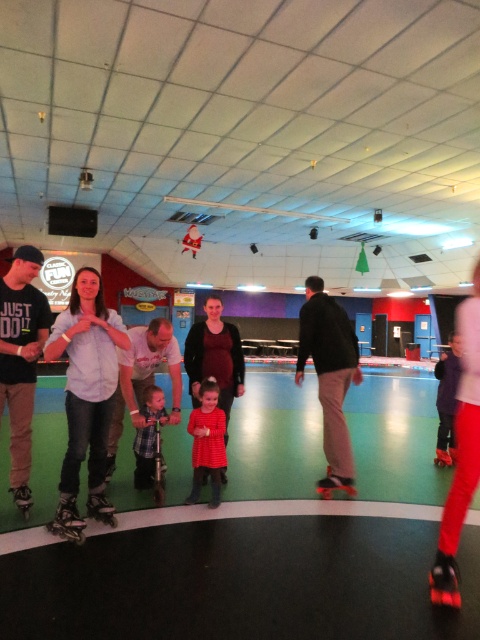
Is black matte jacket at center positioned before plaid shirt at center?

No, it is not.

Does black matte jacket at center appear on the right side of plaid shirt at center?

Indeed, black matte jacket at center is positioned on the right side of plaid shirt at center.

Describe the element at coordinates (330, 378) in the screenshot. I see `black matte jacket at center` at that location.

Where is `black matte jacket at center`? The height and width of the screenshot is (640, 480). black matte jacket at center is located at coordinates (330, 378).

Can you confirm if shiny black roller skate at lower left is smaller than shiny silver roller skate at lower left?

No, shiny black roller skate at lower left is not smaller than shiny silver roller skate at lower left.

Is point (84, 538) positioned before point (91, 499)?

Yes, point (84, 538) is closer to viewer.

Identify the location of shiny black roller skate at lower left. (68, 520).

What do you see at coordinates (21, 358) in the screenshot?
I see `black matte shirt at left` at bounding box center [21, 358].

How far apart are black matte shirt at left and black matte jacket at center?

black matte shirt at left and black matte jacket at center are 2.07 meters apart.

Where is `black matte shirt at left`? Image resolution: width=480 pixels, height=640 pixels. black matte shirt at left is located at coordinates (21, 358).

Find the location of `black matte shirt at left`. black matte shirt at left is located at coordinates (21, 358).